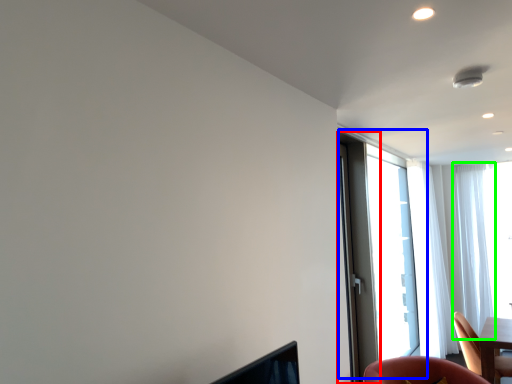
Question: Which object is the closest to the screen door (highlighted by a red box)? Choose among these: window (highlighted by a blue box) or curtain (highlighted by a green box).

Choices:
 (A) window
 (B) curtain

Answer: (A)